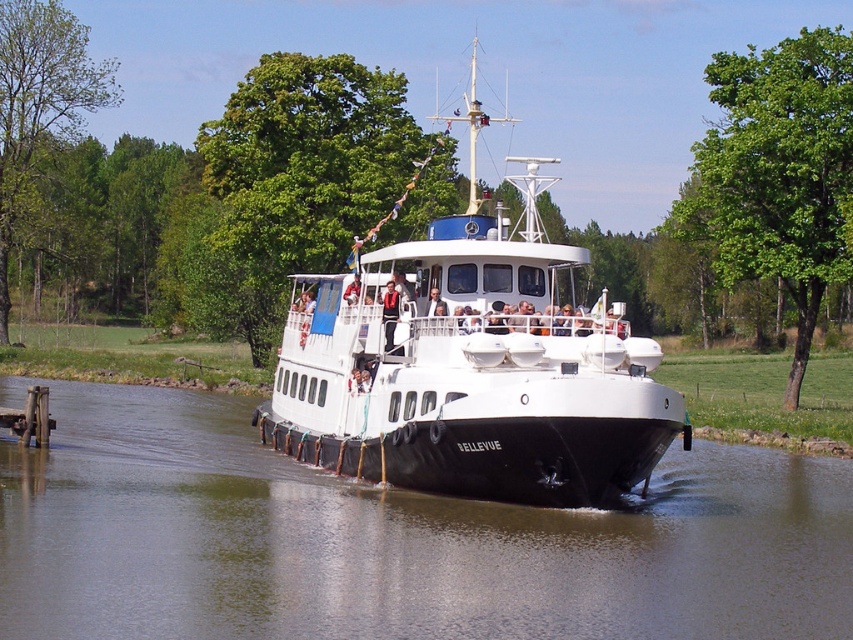
Question: Which of the following is the closest to the observer?

Choices:
 (A) (548, 264)
 (B) (35, 401)

Answer: (A)

Question: Which point is farther to the camera?

Choices:
 (A) (16, 429)
 (B) (425, 323)
 (C) (618, 550)

Answer: (A)

Question: Is black rubber boat at center closer to the viewer compared to wooden planks at lower left?

Choices:
 (A) yes
 (B) no

Answer: (A)

Question: Is black rubber boat at center behind white matte boat at center?

Choices:
 (A) yes
 (B) no

Answer: (B)

Question: Among these points, which one is nearest to the camera?

Choices:
 (A) (561, 582)
 (B) (22, 416)

Answer: (A)

Question: Is black rubber boat at center thinner than wooden planks at lower left?

Choices:
 (A) no
 (B) yes

Answer: (A)